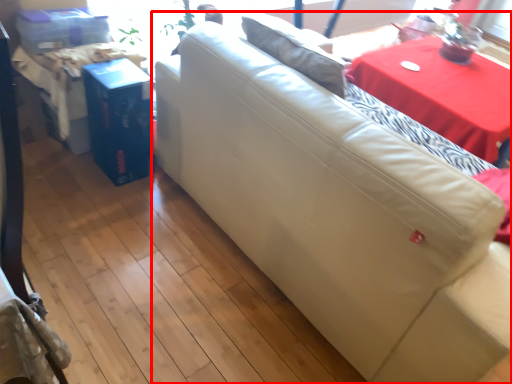
Question: From the image's perspective, what is the correct spatial relationship of studio couch (annotated by the red box) in relation to table?

Choices:
 (A) above
 (B) below

Answer: (B)